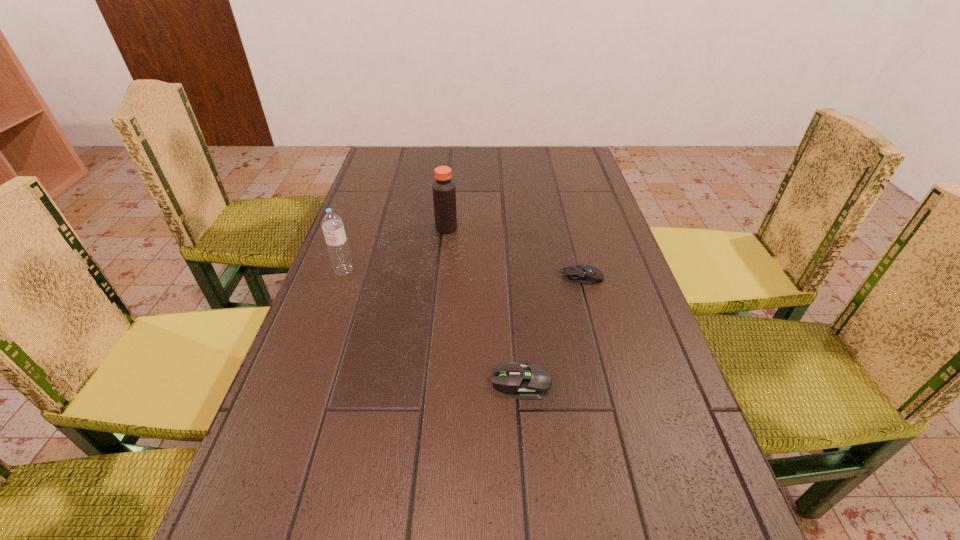
Image resolution: width=960 pixels, height=540 pixels. I want to click on free space that satisfies the following two spatial constraints: 1. on the front side of the water bottle; 2. on the right side of the nearer computer mouse, so click(304, 382).